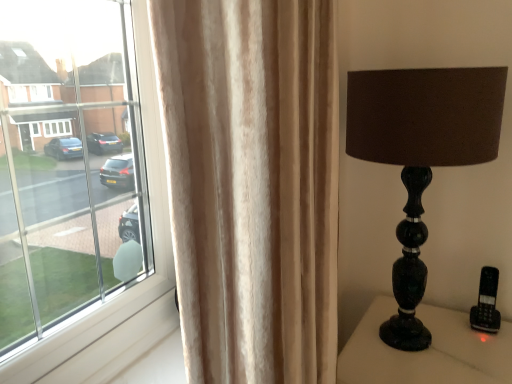
Question: Does black marble lamp at right have a lesser height compared to shiny black glass lamp at right?

Choices:
 (A) yes
 (B) no

Answer: (A)

Question: Is black marble lamp at right to the left of shiny black glass lamp at right from the viewer's perspective?

Choices:
 (A) yes
 (B) no

Answer: (B)

Question: Is black marble lamp at right oriented away from shiny black glass lamp at right?

Choices:
 (A) no
 (B) yes

Answer: (A)

Question: Considering the relative positions of black marble lamp at right and shiny black glass lamp at right in the image provided, is black marble lamp at right to the right of shiny black glass lamp at right from the viewer's perspective?

Choices:
 (A) no
 (B) yes

Answer: (B)

Question: Is black marble lamp at right closer to camera compared to shiny black glass lamp at right?

Choices:
 (A) no
 (B) yes

Answer: (A)

Question: Is black marble lamp at right inside or outside of beige velvet curtain at left?

Choices:
 (A) inside
 (B) outside

Answer: (B)

Question: Does point coord(495,344) appear closer or farther from the camera than point coord(285,114)?

Choices:
 (A) closer
 (B) farther

Answer: (B)

Question: Considering the positions of black marble lamp at right and beige velvet curtain at left in the image, is black marble lamp at right wider or thinner than beige velvet curtain at left?

Choices:
 (A) thin
 (B) wide

Answer: (B)

Question: Is black marble lamp at right bigger or smaller than beige velvet curtain at left?

Choices:
 (A) big
 (B) small

Answer: (A)

Question: Is beige velvet curtain at left in front of or behind black marble lamp at right in the image?

Choices:
 (A) behind
 (B) front

Answer: (B)

Question: Is beige velvet curtain at left bigger or smaller than black marble lamp at right?

Choices:
 (A) big
 (B) small

Answer: (B)

Question: From the image's perspective, relative to black marble lamp at right, is beige velvet curtain at left above or below?

Choices:
 (A) below
 (B) above

Answer: (B)

Question: Would you say beige velvet curtain at left is to the left or to the right of black marble lamp at right in the picture?

Choices:
 (A) left
 (B) right

Answer: (A)

Question: Is shiny black glass lamp at right bigger or smaller than beige velvet curtain at left?

Choices:
 (A) big
 (B) small

Answer: (A)

Question: Is shiny black glass lamp at right taller or shorter than beige velvet curtain at left?

Choices:
 (A) tall
 (B) short

Answer: (B)